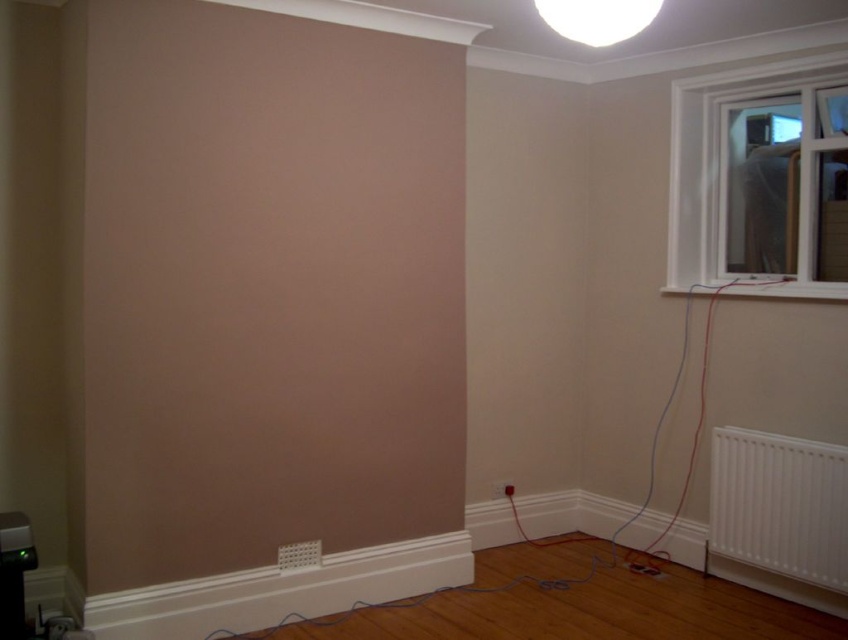
You are standing in the room and want to locate the point at coordinates (717, 154). Based on the scene description, where is this point located?

The point at coordinates (717, 154) is located on the white plastic window at upper right.

You are an interior designer planning to place a new rectangular shelf that is 1.2 meters wide in this room. You want to position it either below the white glossy ceiling light at upper center or next to the white plastic radiator at lower right. Based on their widths, which location would allow the shelf to fit better?

The white plastic radiator at lower right has a larger width than the white glossy ceiling light at upper center. Therefore, placing the 1.2 meter wide shelf next to the white plastic radiator at lower right would provide sufficient space for it to fit better.